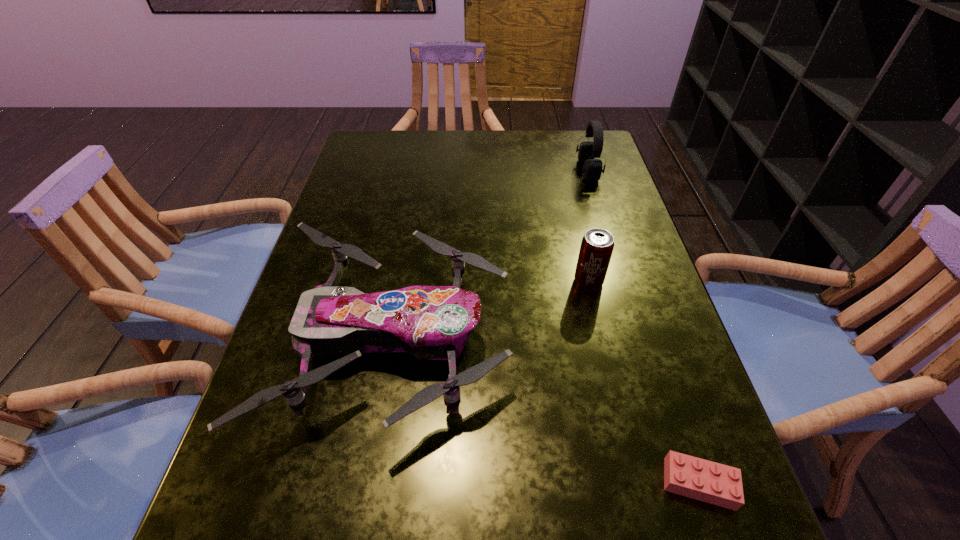
Where is `vacant point located between the drone and the Lego`? vacant point located between the drone and the Lego is located at coordinates (546, 411).

The width and height of the screenshot is (960, 540). What are the coordinates of `free space between the beer can and the leftmost object` in the screenshot? It's located at (491, 310).

Where is `vacant area that lies between the headset and the second shortest object`? The height and width of the screenshot is (540, 960). vacant area that lies between the headset and the second shortest object is located at coordinates (491, 255).

Where is `free space between the farthest object and the leftmost object`? free space between the farthest object and the leftmost object is located at coordinates (491, 255).

Identify the location of free space between the shortest object and the beer can. (643, 382).

Image resolution: width=960 pixels, height=540 pixels. I want to click on free space between the leftmost object and the headset, so click(491, 255).

You are a GUI agent. You are given a task and a screenshot of the screen. Output one action in this format:
    pyautogui.click(x=<x>, y=<y>)
    Task: Click on the unoccupied position between the third object from right to left and the headset
    Image resolution: width=960 pixels, height=540 pixels.
    Given the screenshot: What is the action you would take?
    (588, 226)

You are a GUI agent. You are given a task and a screenshot of the screen. Output one action in this format:
    pyautogui.click(x=<x>, y=<y>)
    Task: Click on the empty space that is in between the second object from left to right and the drone
    Image resolution: width=960 pixels, height=540 pixels.
    Given the screenshot: What is the action you would take?
    pyautogui.click(x=491, y=310)

In order to click on free space between the farthest object and the leftmost object in this screenshot , I will do `click(491, 255)`.

You are a GUI agent. You are given a task and a screenshot of the screen. Output one action in this format:
    pyautogui.click(x=<x>, y=<y>)
    Task: Click on the empty space that is in between the third object from right to left and the farthest object
    
    Given the screenshot: What is the action you would take?
    pyautogui.click(x=588, y=226)